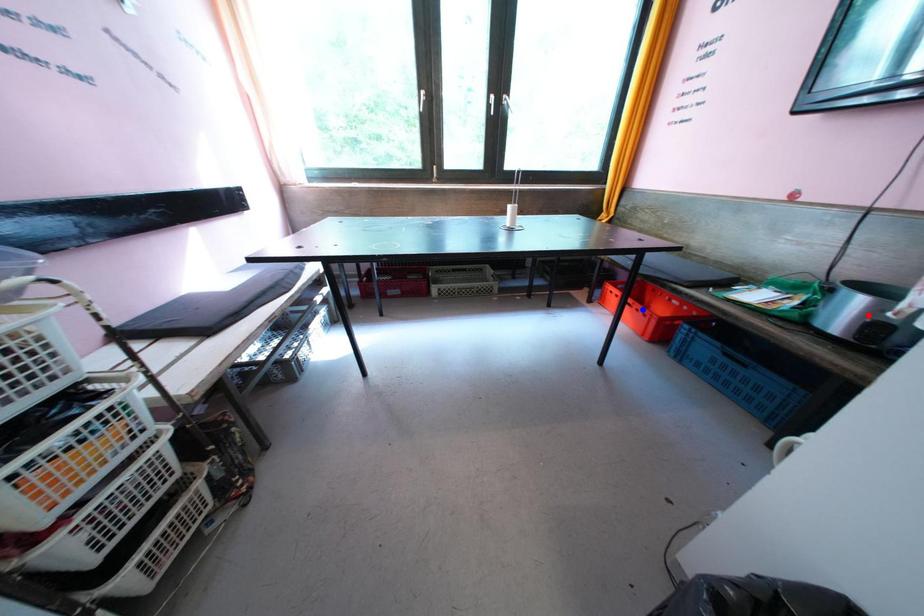
Question: Which of the two points in the image is closer to the camera?

Choices:
 (A) Blue point is closer.
 (B) Red point is closer.

Answer: (B)